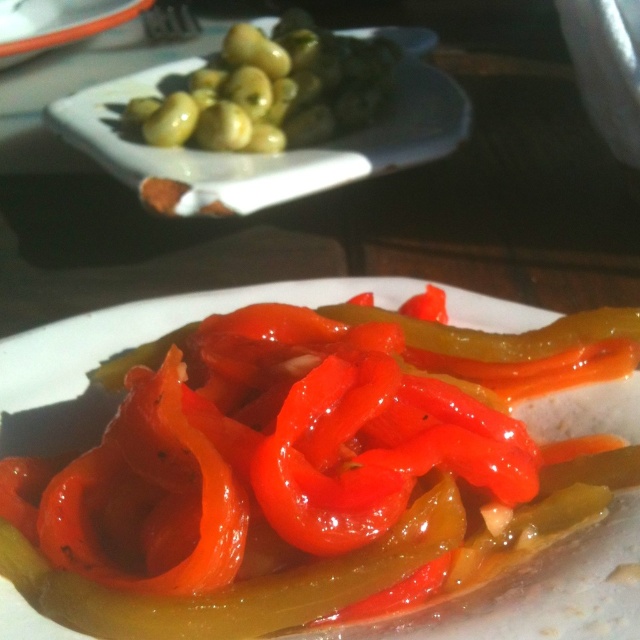
Is point (621, 492) more distant than point (280, 29)?

No, it is not.

Between glossy red pepper at center and green glossy olives at upper left, which one has less height?

green glossy olives at upper left is shorter.

Is point (122, 317) farther from viewer compared to point (365, 115)?

No, it is in front of (365, 115).

You are a GUI agent. You are given a task and a screenshot of the screen. Output one action in this format:
    pyautogui.click(x=<x>, y=<y>)
    Task: Click on the glossy red pepper at center
    
    Given the screenshot: What is the action you would take?
    pyautogui.click(x=540, y=593)